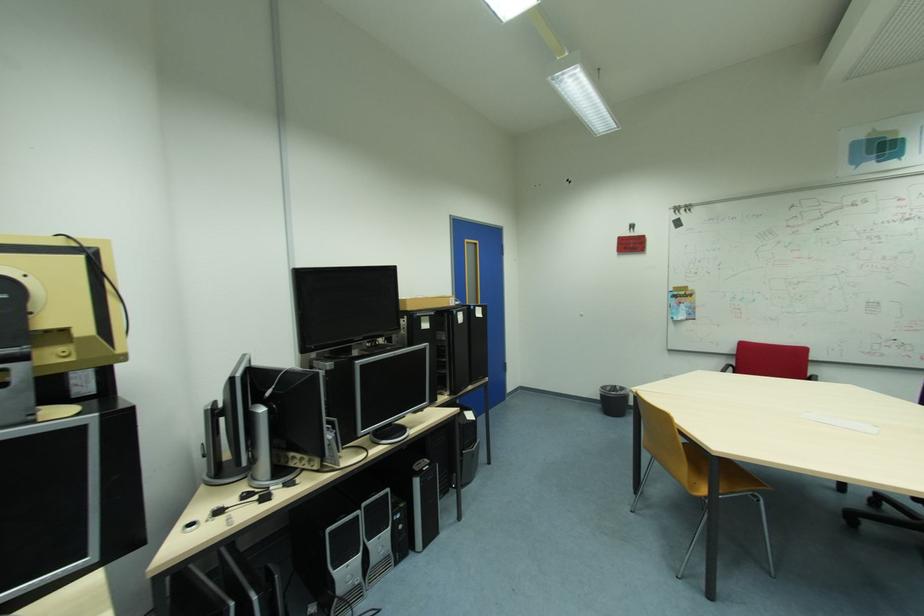
Where would you lift the cardboard box? Please return your answer as a coordinate pair (x, y).

(67, 301)